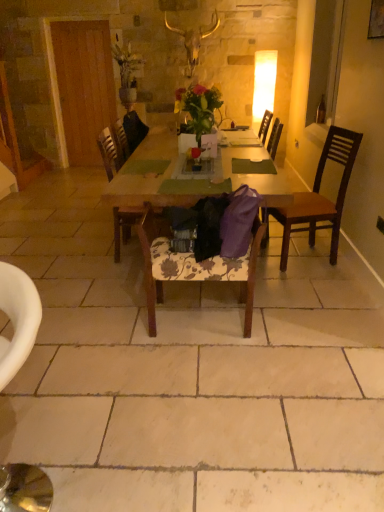
Identify the location of vacant area that lies in front of wooden table at center. (233, 367).